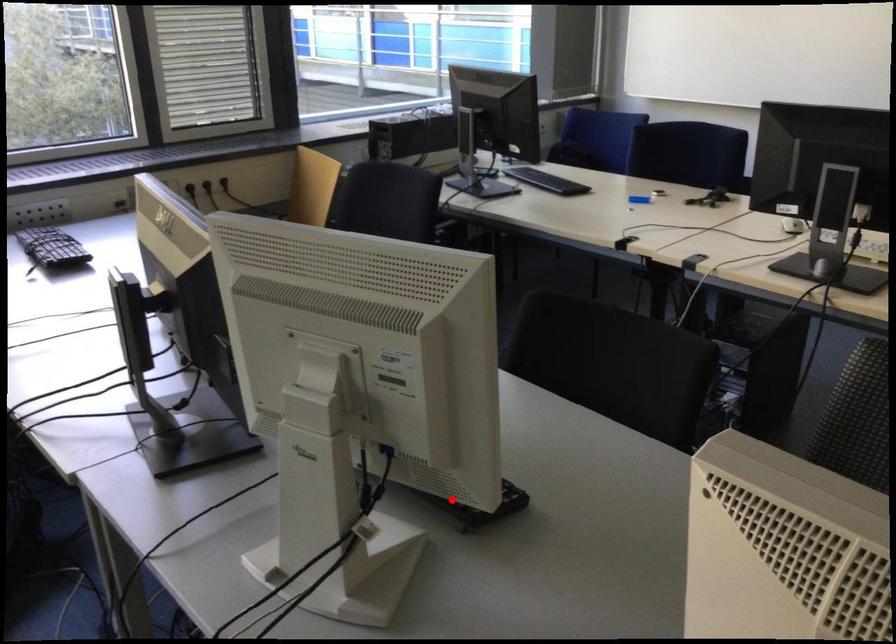
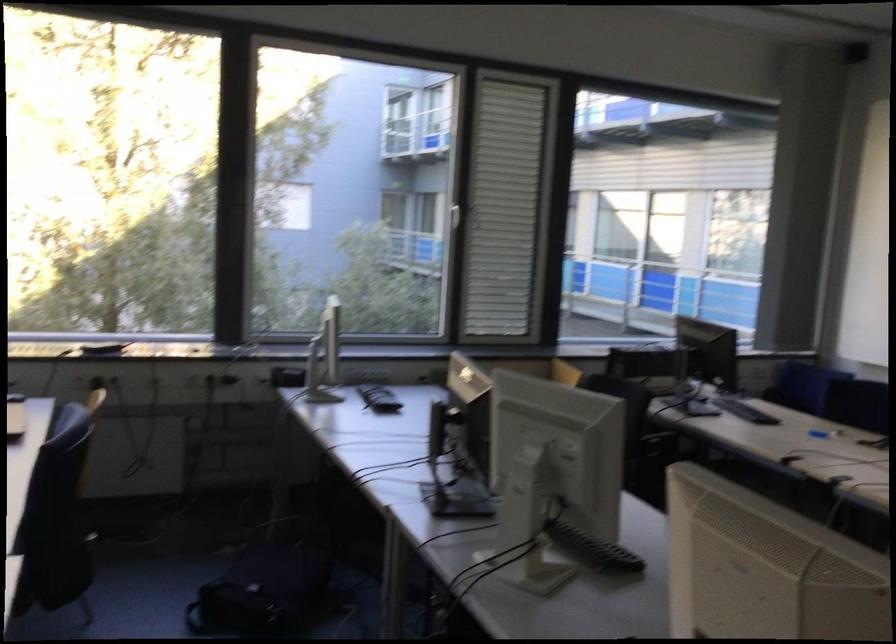
Find the pixel in the second image that matches the highlighted location in the first image.

(592, 549)